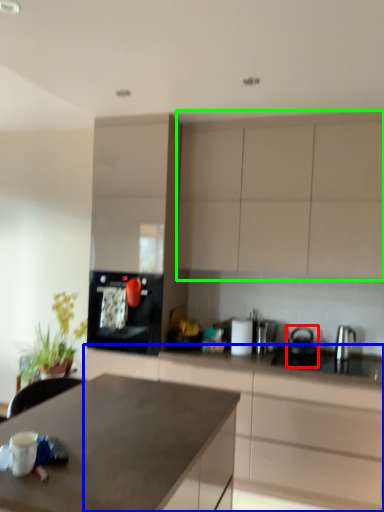
Question: Which object is the closest to the kitchen appliance (highlighted by a red box)? Choose among these: cabinetry (highlighted by a blue box) or cabinetry (highlighted by a green box).

Choices:
 (A) cabinetry
 (B) cabinetry

Answer: (A)